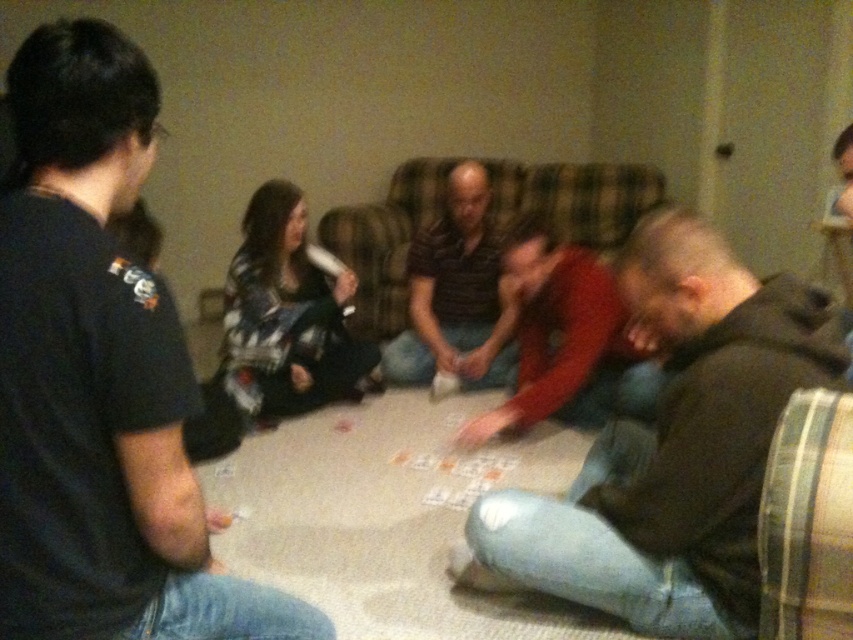
You are standing in the living room and see two points marked in the image. Which point is closer to you, point (x=405, y=250) or point (x=514, y=225)?

Point (x=405, y=250) is closer to you because it is further to the viewer than point (x=514, y=225).